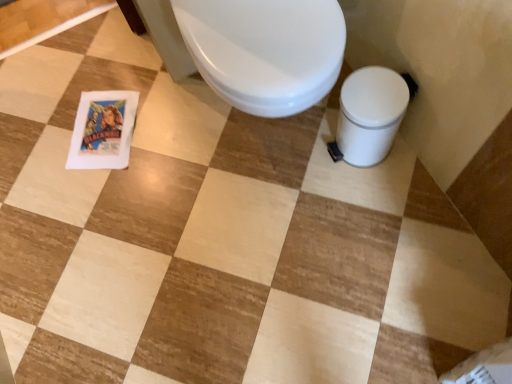
Locate an element on the screen. The width and height of the screenshot is (512, 384). free space in front of white glossy toilet bowl at lower right is located at coordinates pos(381,200).